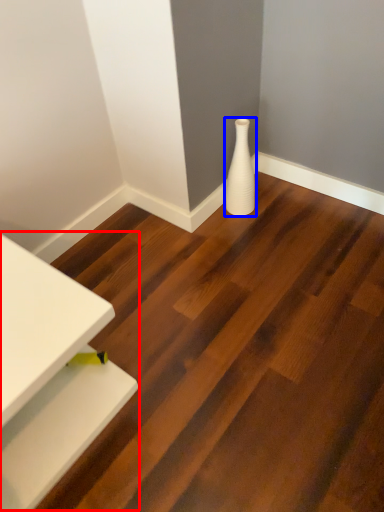
Question: Which of the following is the farthest to the observer, table (highlighted by a red box) or vase (highlighted by a blue box)?

Choices:
 (A) table
 (B) vase

Answer: (B)